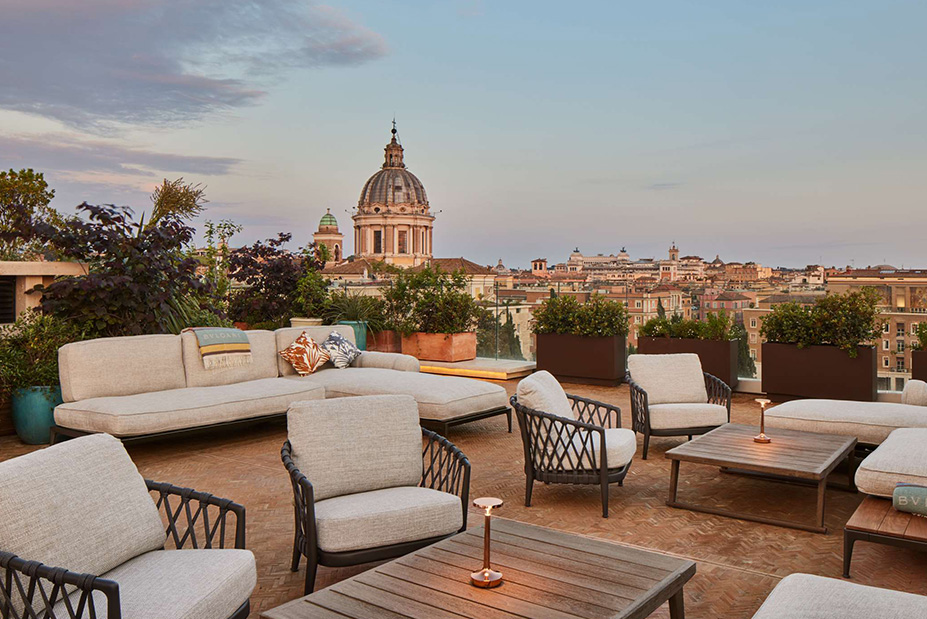
The height and width of the screenshot is (619, 927). I want to click on light, so click(x=485, y=513), click(x=759, y=405).